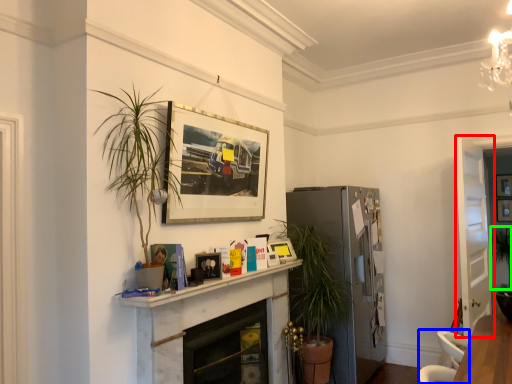
Question: Which object is positioned farthest from glass door (highlighted by a red box)? Select from swivel chair (highlighted by a blue box) and plant (highlighted by a green box).

Choices:
 (A) swivel chair
 (B) plant

Answer: (A)